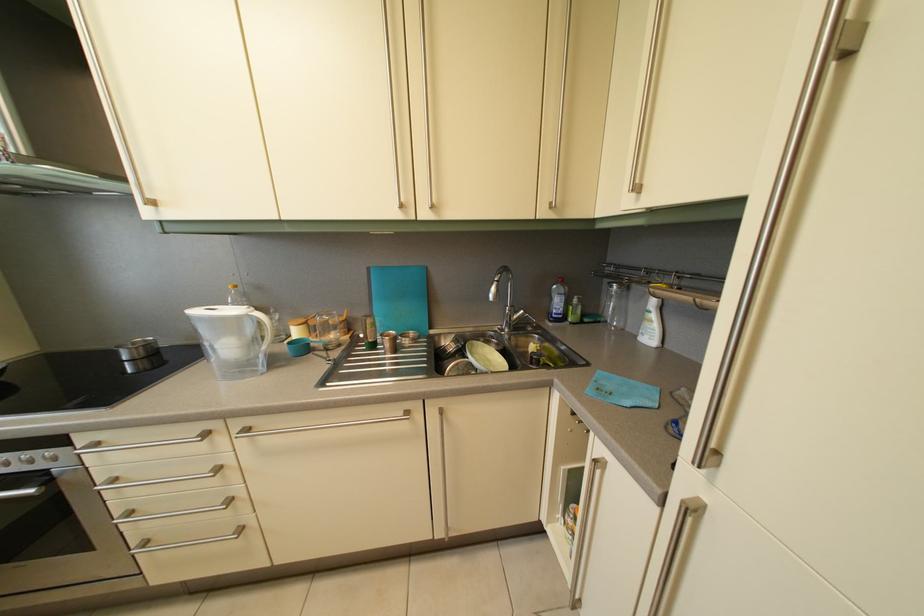
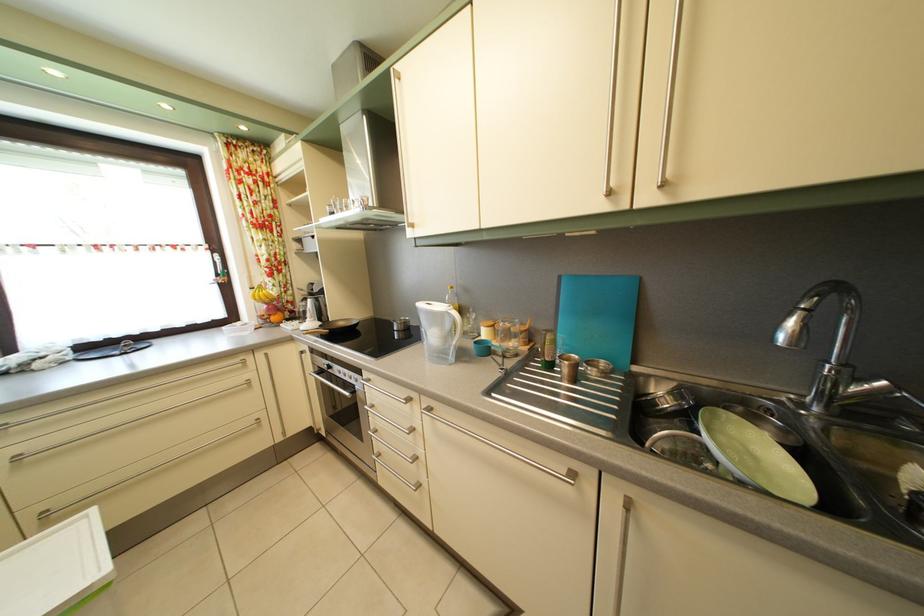
The point at (254,438) is marked in the first image. Where is the corresponding point in the second image?

(438, 416)